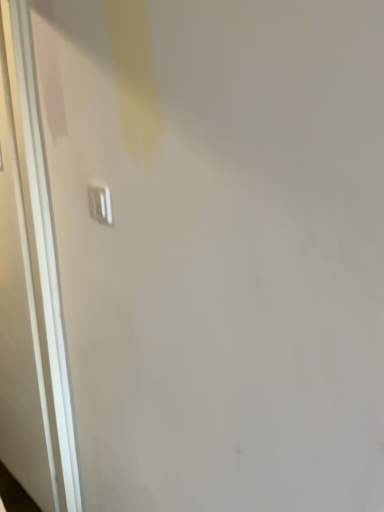
In order to face white plastic light switch at upper left, should I rotate leftwards or rightwards?

Turn left by 12.139 degrees to look at white plastic light switch at upper left.

I want to click on white plastic light switch at upper left, so click(x=100, y=204).

What do you see at coordinates (100, 204) in the screenshot?
I see `white plastic light switch at upper left` at bounding box center [100, 204].

This screenshot has height=512, width=384. I want to click on white glossy door at left, so click(x=30, y=289).

This screenshot has height=512, width=384. What do you see at coordinates (30, 289) in the screenshot?
I see `white glossy door at left` at bounding box center [30, 289].

Locate an element on the screen. The width and height of the screenshot is (384, 512). white plastic light switch at upper left is located at coordinates (100, 204).

Which is more to the left, white glossy door at left or white plastic light switch at upper left?

white glossy door at left.

Based on the photo, does white glossy door at left come behind white plastic light switch at upper left?

Yes.

Is point (67, 493) positioned before point (100, 214)?

No, (67, 493) is further to viewer.

From the image's perspective, is white glossy door at left positioned above or below white plastic light switch at upper left?

From the image's perspective, white glossy door at left appears below white plastic light switch at upper left.

From a real-world perspective, which object stands above the other?

white plastic light switch at upper left is physically above.

Considering the sizes of objects white glossy door at left and white plastic light switch at upper left in the image provided, who is thinner, white glossy door at left or white plastic light switch at upper left?

Thinner between the two is white plastic light switch at upper left.

Consider the image. Is white glossy door at left taller or shorter than white plastic light switch at upper left?

white glossy door at left is taller than white plastic light switch at upper left.

Considering the sizes of white glossy door at left and white plastic light switch at upper left in the image, is white glossy door at left bigger or smaller than white plastic light switch at upper left?

In the image, white glossy door at left appears to be larger than white plastic light switch at upper left.

Can we say white glossy door at left lies outside white plastic light switch at upper left?

Absolutely, white glossy door at left is external to white plastic light switch at upper left.

Are white glossy door at left and white plastic light switch at upper left located far from each other?

No, white glossy door at left is in close proximity to white plastic light switch at upper left.

Is white glossy door at left oriented away from white plastic light switch at upper left?

No, white glossy door at left is not facing away from white plastic light switch at upper left.

Measure the distance from white glossy door at left to white plastic light switch at upper left.

white glossy door at left and white plastic light switch at upper left are 26.34 inches apart.

Identify the location of door that appears behind the white plastic light switch at upper left. (30, 289).

Which is more to the right, white plastic light switch at upper left or white glossy door at left?

white plastic light switch at upper left is more to the right.

Relative to white glossy door at left, is white plastic light switch at upper left in front or behind?

In the image, white plastic light switch at upper left appears in front of white glossy door at left.

Which point is more distant from viewer, (90, 209) or (9, 173)?

Point (9, 173)

Looking at this image, from the image's perspective, is white plastic light switch at upper left above or below white glossy door at left?

From the image's perspective, white plastic light switch at upper left appears above white glossy door at left.

From a real-world perspective, between white plastic light switch at upper left and white glossy door at left, who is vertically higher?

From a 3D spatial view, white plastic light switch at upper left is above.

In terms of width, does white plastic light switch at upper left look wider or thinner when compared to white glossy door at left?

Considering their sizes, white plastic light switch at upper left looks slimmer than white glossy door at left.

Considering the sizes of objects white plastic light switch at upper left and white glossy door at left in the image provided, who is taller, white plastic light switch at upper left or white glossy door at left?

With more height is white glossy door at left.

Does white plastic light switch at upper left have a smaller size compared to white glossy door at left?

Yes, white plastic light switch at upper left is smaller than white glossy door at left.

Is white plastic light switch at upper left positioned beyond the bounds of white glossy door at left?

Yes, white plastic light switch at upper left is not within white glossy door at left.

Is white plastic light switch at upper left not near white glossy door at left?

white plastic light switch at upper left is actually quite close to white glossy door at left.

Is white plastic light switch at upper left facing towards white glossy door at left?

No, white plastic light switch at upper left is not oriented towards white glossy door at left.

Can you tell me how much white plastic light switch at upper left and white glossy door at left differ in facing direction?

The facing directions of white plastic light switch at upper left and white glossy door at left are 6.25 degrees apart.

Measure the distance from white plastic light switch at upper left to white glossy door at left.

white plastic light switch at upper left and white glossy door at left are 26.34 inches apart.

In order to click on light switch located on the right of white glossy door at left in this screenshot , I will do `click(100, 204)`.

The image size is (384, 512). I want to click on door to the left of white plastic light switch at upper left, so click(x=30, y=289).

Locate an element on the screen. light switch above the white glossy door at left (from a real-world perspective) is located at coordinates point(100,204).